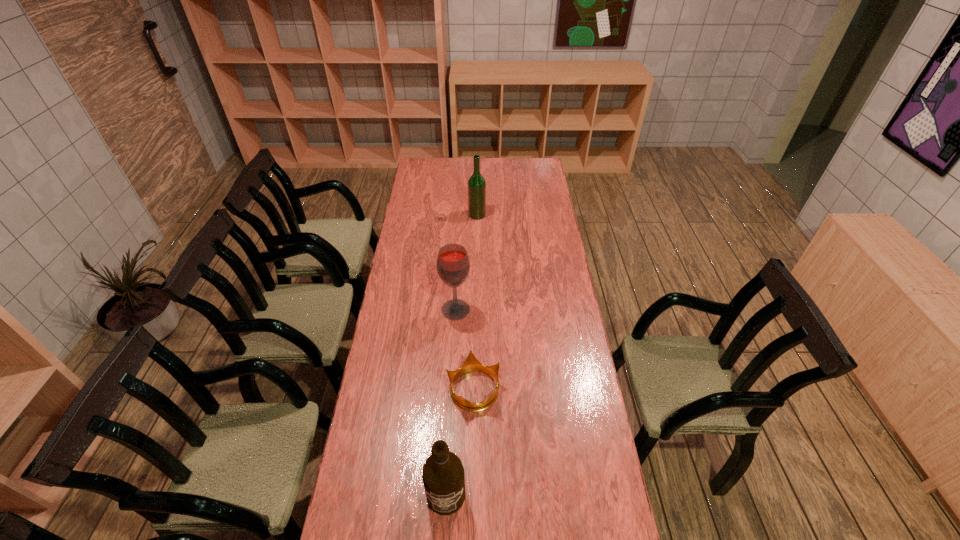
The image size is (960, 540). Find the location of `vacant area between the nearest object and the second nearest alcohol`. vacant area between the nearest object and the second nearest alcohol is located at coordinates (451, 402).

Where is `free spot between the farthest alcohol and the nearest object`? Image resolution: width=960 pixels, height=540 pixels. free spot between the farthest alcohol and the nearest object is located at coordinates click(462, 355).

Where is `object identified as the closest to the third nearest object`? The width and height of the screenshot is (960, 540). object identified as the closest to the third nearest object is located at coordinates (471, 363).

The width and height of the screenshot is (960, 540). What are the coordinates of `object that is the third closest one to the crown` in the screenshot? It's located at (476, 184).

This screenshot has width=960, height=540. I want to click on alcohol object that ranks as the closest to the crown, so pyautogui.click(x=443, y=477).

Identify which alcohol is the second closest to the second farthest object. Please provide its 2D coordinates. Your answer should be formatted as a tuple, i.e. [(x, y)], where the tuple contains the x and y coordinates of a point satisfying the conditions above.

[(443, 477)]